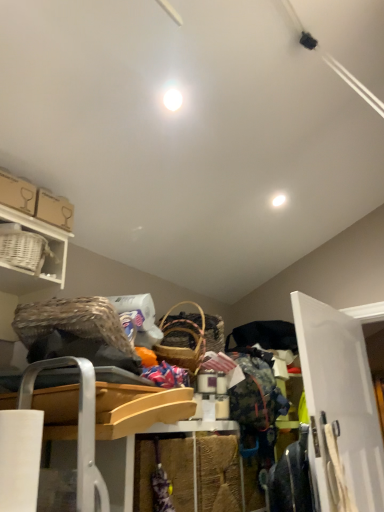
Question: From a real-world perspective, is white glossy light fixture at upper center, which ranks as the 1th light in bottom-to-top order, below white wicker basket at upper left?

Choices:
 (A) yes
 (B) no

Answer: (B)

Question: From the image's perspective, is white glossy light fixture at upper center, which ranks as the 1th light in bottom-to-top order, located above white wicker basket at upper left?

Choices:
 (A) no
 (B) yes

Answer: (B)

Question: Is white glossy light fixture at upper center, the 1th light positioned from the back, further to the viewer compared to white wicker basket at upper left?

Choices:
 (A) yes
 (B) no

Answer: (A)

Question: Does white glossy light fixture at upper center, marked as the 2th light in a top-to-bottom arrangement, appear on the left side of white wicker basket at upper left?

Choices:
 (A) yes
 (B) no

Answer: (B)

Question: Considering the relative sizes of white glossy light fixture at upper center, which ranks as the 1th light in right-to-left order, and white wicker basket at upper left in the image provided, is white glossy light fixture at upper center, which ranks as the 1th light in right-to-left order, taller than white wicker basket at upper left?

Choices:
 (A) yes
 (B) no

Answer: (B)

Question: From the image's perspective, is white wicker basket at upper left above or below floral fabric dress at lower right?

Choices:
 (A) below
 (B) above

Answer: (B)

Question: Is point (18, 273) closer or farther from the camera than point (297, 451)?

Choices:
 (A) closer
 (B) farther

Answer: (A)

Question: Based on their positions, is white wicker basket at upper left located to the left or right of floral fabric dress at lower right?

Choices:
 (A) right
 (B) left

Answer: (B)

Question: Do you think white wicker basket at upper left is within floral fabric dress at lower right, or outside of it?

Choices:
 (A) inside
 (B) outside

Answer: (B)

Question: Looking at their shapes, would you say floral fabric dress at lower right is wider or thinner than white wicker basket at upper left?

Choices:
 (A) thin
 (B) wide

Answer: (A)

Question: In terms of size, does floral fabric dress at lower right appear bigger or smaller than white wicker basket at upper left?

Choices:
 (A) big
 (B) small

Answer: (A)

Question: Visually, is floral fabric dress at lower right positioned to the left or to the right of white wicker basket at upper left?

Choices:
 (A) right
 (B) left

Answer: (A)

Question: From a real-world perspective, is floral fabric dress at lower right above or below white wicker basket at upper left?

Choices:
 (A) below
 (B) above

Answer: (A)

Question: Choose the correct answer: Is white wood door at right inside floral fabric dress at lower right or outside it?

Choices:
 (A) outside
 (B) inside

Answer: (A)

Question: Does point click(x=360, y=420) appear closer or farther from the camera than point click(x=296, y=484)?

Choices:
 (A) closer
 (B) farther

Answer: (B)